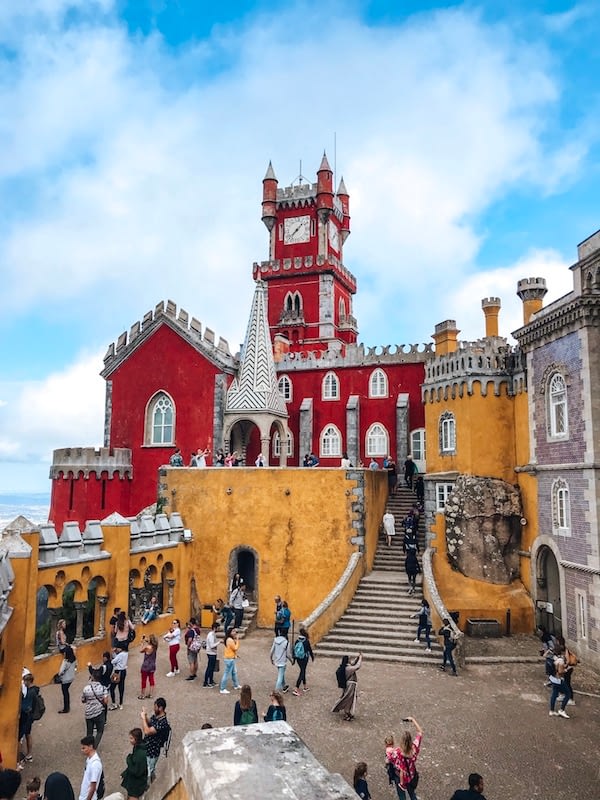
The width and height of the screenshot is (600, 800). Identify the location of clock. (294, 229).